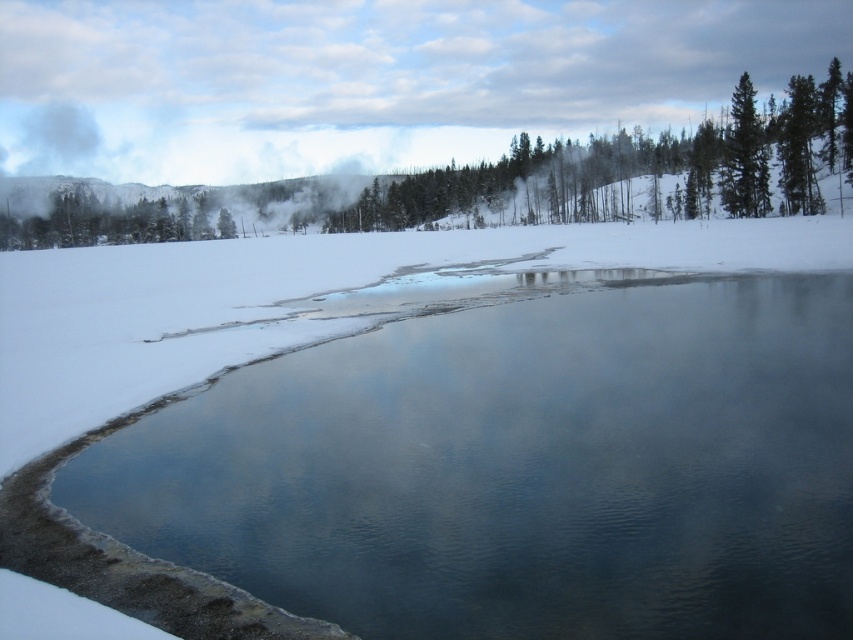
Does green textured tree at upper center lie in front of green matte tree at upper right?

Yes, it is.

Is green textured tree at upper center to the right of green matte tree at upper right from the viewer's perspective?

In fact, green textured tree at upper center is to the left of green matte tree at upper right.

Locate an element on the screen. This screenshot has width=853, height=640. green textured tree at upper center is located at coordinates (383, 193).

What are the coordinates of `green textured tree at upper center` in the screenshot? It's located at (383, 193).

Is clear water at center bigger than green matte tree at upper right?

No.

Between clear water at center and green matte tree at upper right, which one is positioned lower?

clear water at center is lower down.

Does point (779, 374) come closer to viewer compared to point (743, 173)?

Yes, point (779, 374) is closer to viewer.

What are the coordinates of `clear water at center` in the screenshot? It's located at (521, 468).

Who is lower down, clear water at center or green matte tree at left?

clear water at center is lower down.

Between clear water at center and green matte tree at left, which one has less height?

clear water at center is shorter.

Is point (498, 509) positioned in front of point (88, 189)?

Yes, it is.

The image size is (853, 640). I want to click on clear water at center, so click(521, 468).